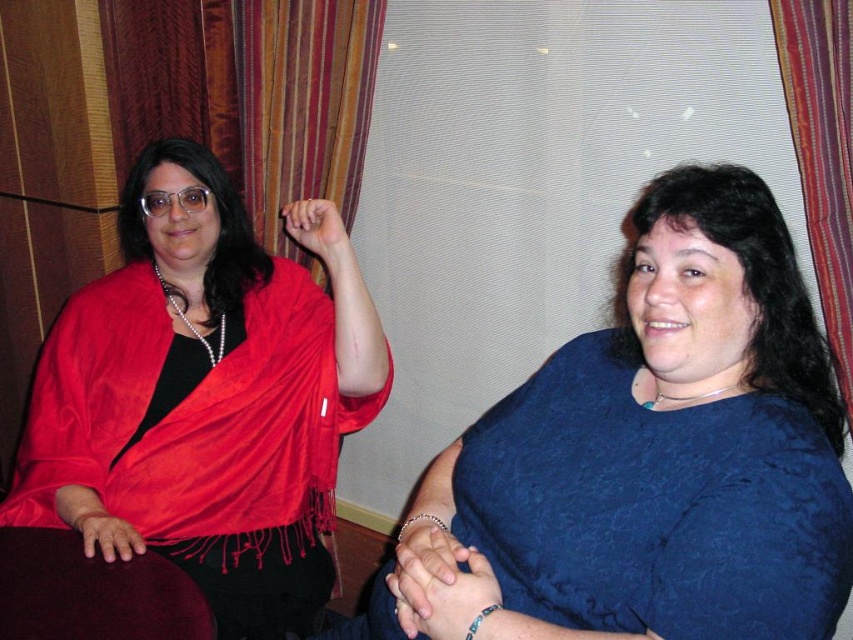
Question: Which point appears farthest from the camera in this image?

Choices:
 (A) (241, 547)
 (B) (556, 449)

Answer: (A)

Question: Does satin red scarf at left have a larger size compared to striped fabric curtain at right?

Choices:
 (A) no
 (B) yes

Answer: (B)

Question: Is satin red scarf at left behind blue satin blouse at center?

Choices:
 (A) no
 (B) yes

Answer: (B)

Question: Can you confirm if satin red scarf at left is positioned to the left of striped fabric curtain at right?

Choices:
 (A) yes
 (B) no

Answer: (A)

Question: Which of the following is the closest to the observer?

Choices:
 (A) (105, 552)
 (B) (849, 292)

Answer: (A)

Question: Estimate the real-world distances between objects in this image. Which object is closer to the blue satin blouse at center?

Choices:
 (A) striped fabric curtain at right
 (B) satin red scarf at left

Answer: (A)